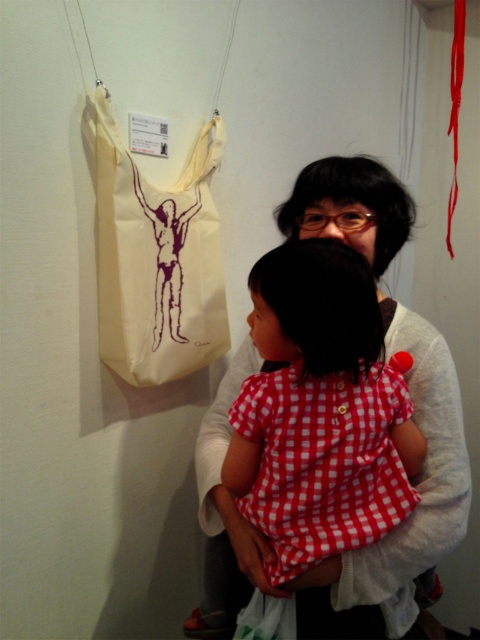
Looking at this image, you are standing in front of a wall display in an indoor area. There is a point at coordinates point (220,396). Can you reach that point with your hand if you extend it fully?

The point (220,396) is 1.21 meters away from you. Since the average arm length is about 0.7 meters, you cannot reach it with your hand extended fully.